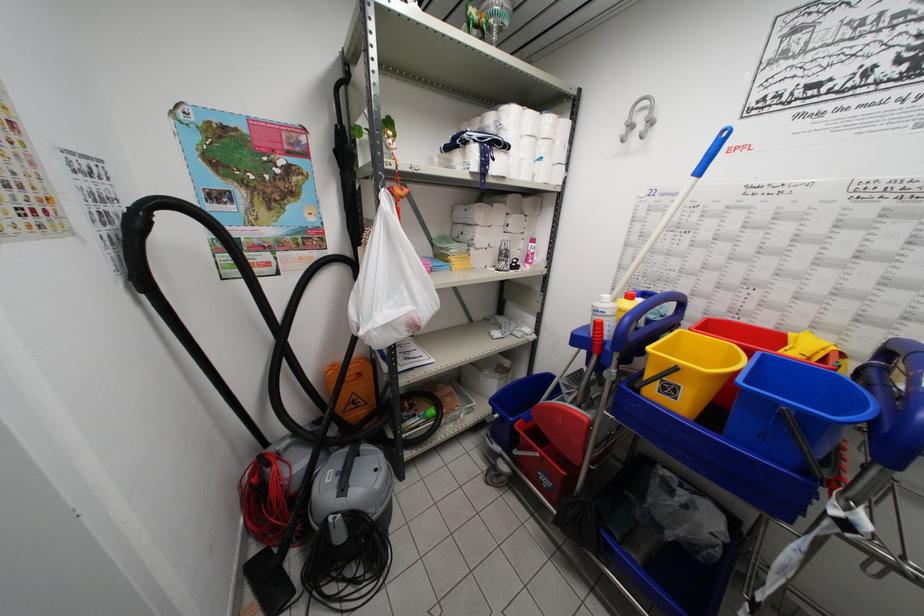
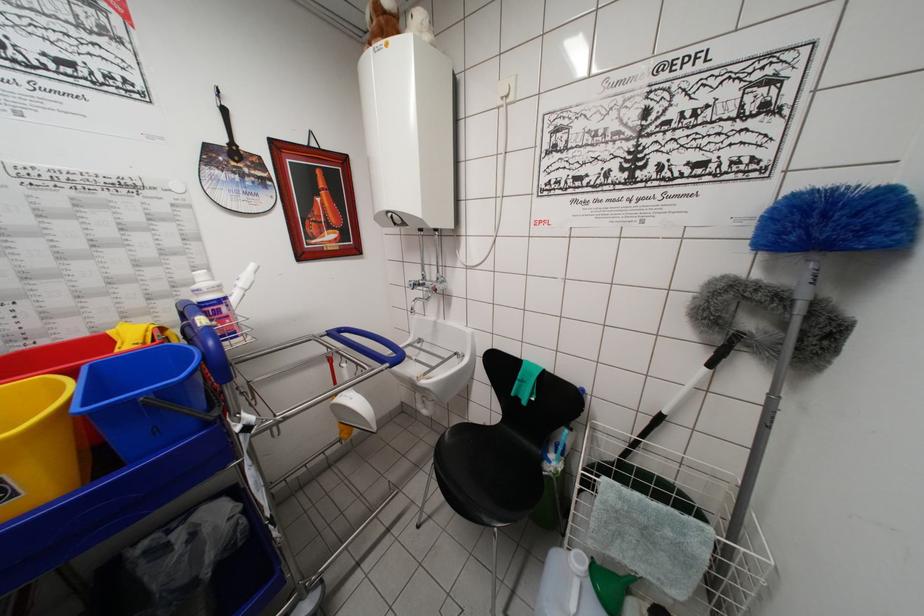
The point at [679,403] is marked in the first image. Where is the corresponding point in the second image?

(20, 500)